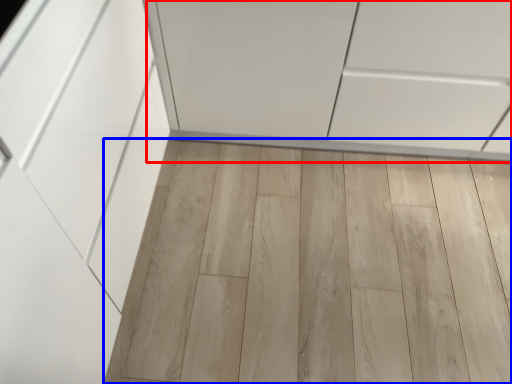
Question: Among these objects, which one is farthest to the camera, cabinetry (highlighted by a red box) or plank (highlighted by a blue box)?

Choices:
 (A) cabinetry
 (B) plank

Answer: (B)